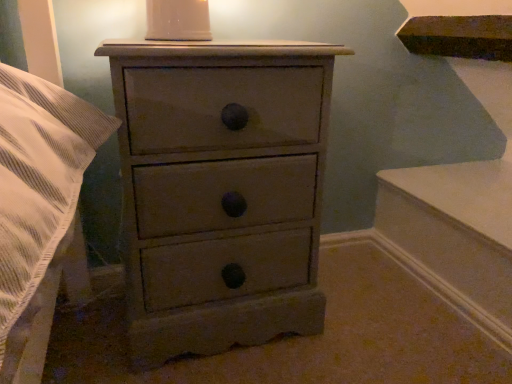
At what (x,y) coordinates should I click in order to perform the action: click on unoccupied region to the right of matte gray chest of drawers at center. Please return your answer as a coordinate pair (x, y). The width and height of the screenshot is (512, 384). Looking at the image, I should click on (373, 320).